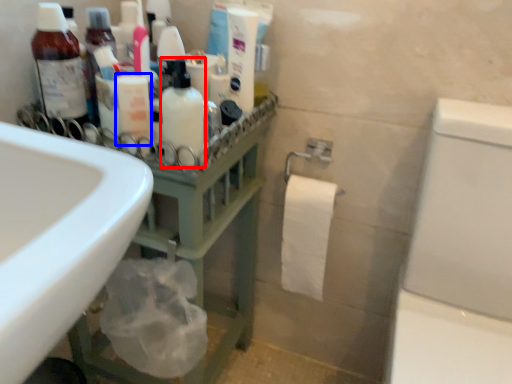
Question: Which point is further to the camera, mouthwash (highlighted by a red box) or toiletry (highlighted by a blue box)?

Choices:
 (A) mouthwash
 (B) toiletry

Answer: (B)